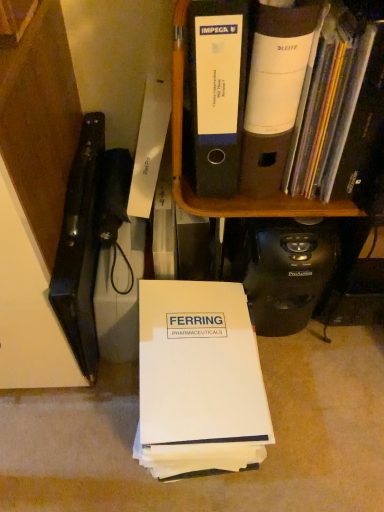
Locate an element on the screen. The image size is (384, 512). empty space that is ontop of white paper at center, the second book in the right-to-left sequence is located at coordinates (179, 323).